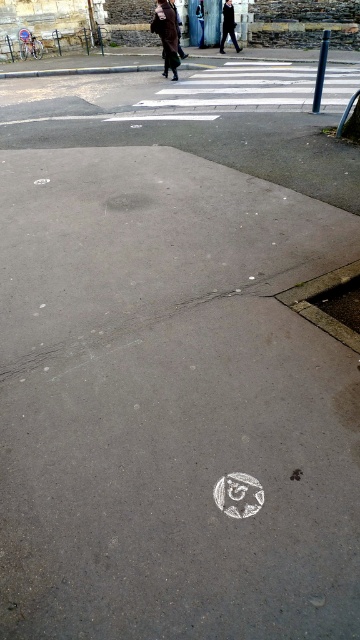
Consider the image. You are a pedestrian trying to cross the street and see the brown wool coat at upper center and the dark gray suit at center. Which person is closer to the crosswalk?

The brown wool coat at upper center is positioned under the dark gray suit at center, meaning the dark gray suit at center is closer to the crosswalk.

You are a pedestrian standing at the point labeled as point (167,35) in the image. Looking towards the circular chalk drawing, which direction should you walk to reach it?

The brown wool coat at upper center is located at point (167,35). Since the circular chalk drawing is at the center of the road section, you should walk towards the center from your current position.

You are a fashion designer observing the street scene. You notice two people wearing a brown wool coat at upper center and a dark gray suit at center. Which clothing item is taller?

The brown wool coat at upper center has a greater height compared to the dark gray suit at center, so the brown wool coat at upper center is taller.